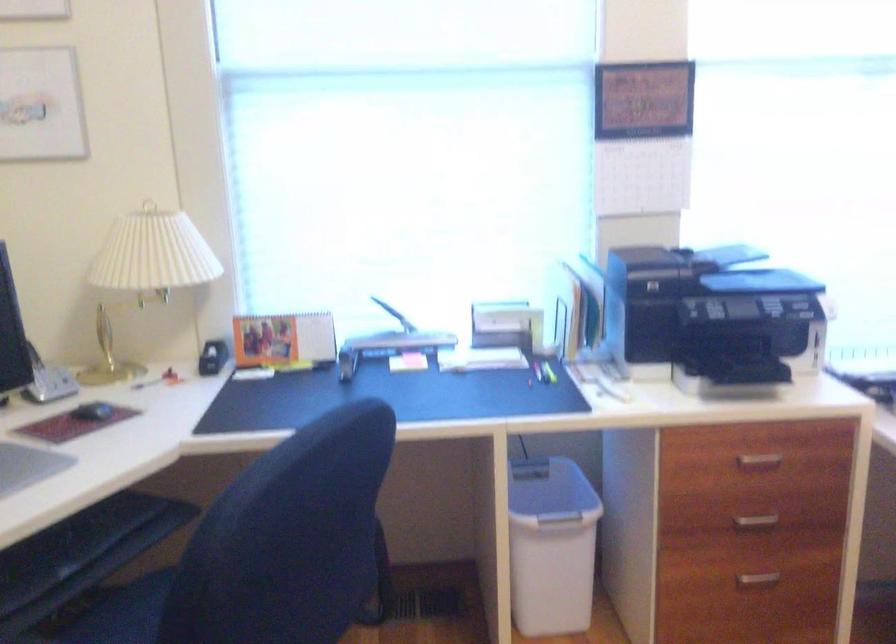
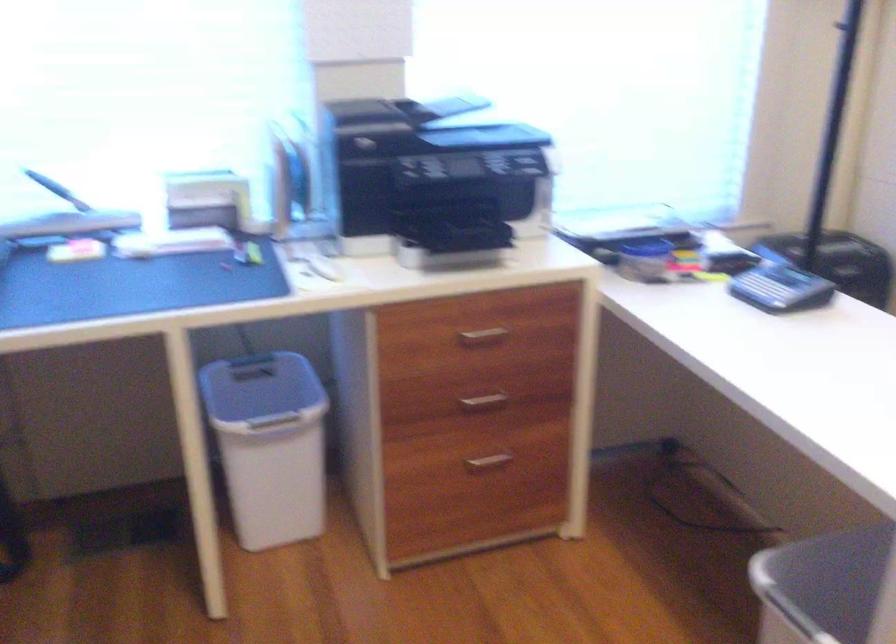
Locate, in the second image, the point that corresponds to the point at 755,459 in the first image.

(483, 334)